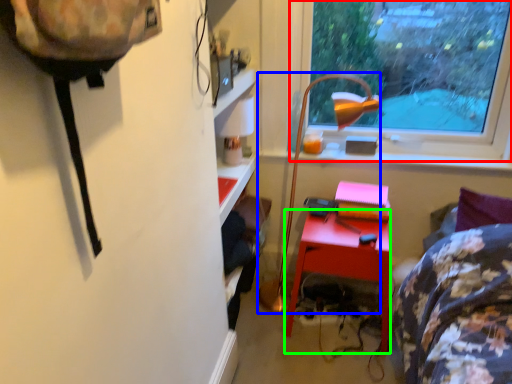
Question: Which object is positioned closest to window (highlighted by a red box)? Select from lamp (highlighted by a blue box) and desk (highlighted by a green box).

Choices:
 (A) lamp
 (B) desk

Answer: (A)